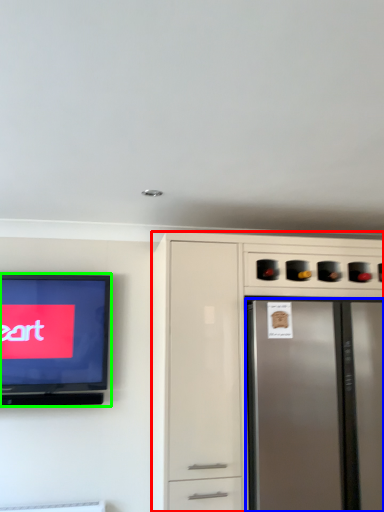
Question: Which object is the closest to the cabinetry (highlighted by a red box)? Choose among these: refrigerator (highlighted by a blue box) or television (highlighted by a green box).

Choices:
 (A) refrigerator
 (B) television

Answer: (A)